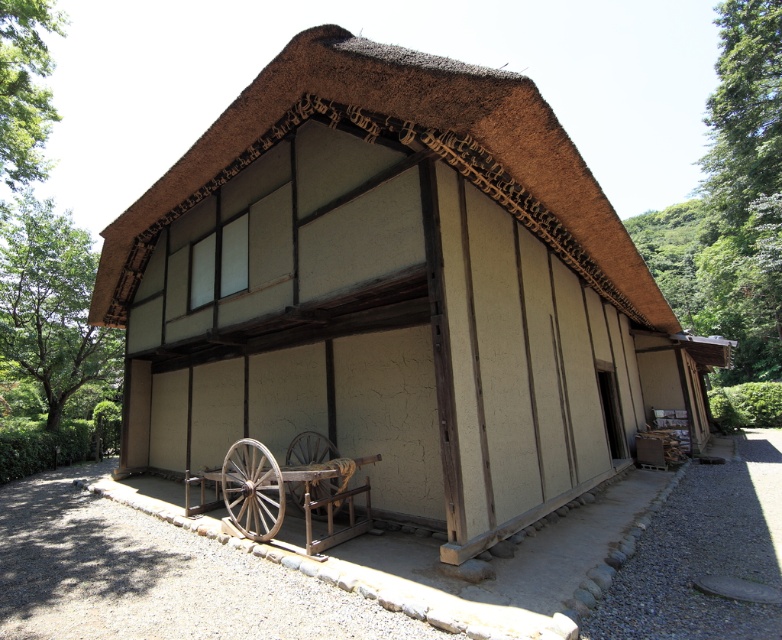
From the picture: You are standing in front of the traditional Japanese building and want to move from the wooden at lower left to the wooden at lower center. Which direction should you move relative to the building?

You should move towards the center relative to the building, as the wooden at lower left is in front of the wooden at lower center, meaning it is closer to you. To reach the wooden at lower center, you need to move towards the center where it is located behind the wooden at lower left.

You are standing in front of the traditional Japanese building and want to take a photo. There are two points marked in the scene, point (152,324) and point (253,536). Which point is closer to your camera lens?

Point (152,324) is further to the camera than point (253,536), so the point closer to the camera lens is point (253,536).